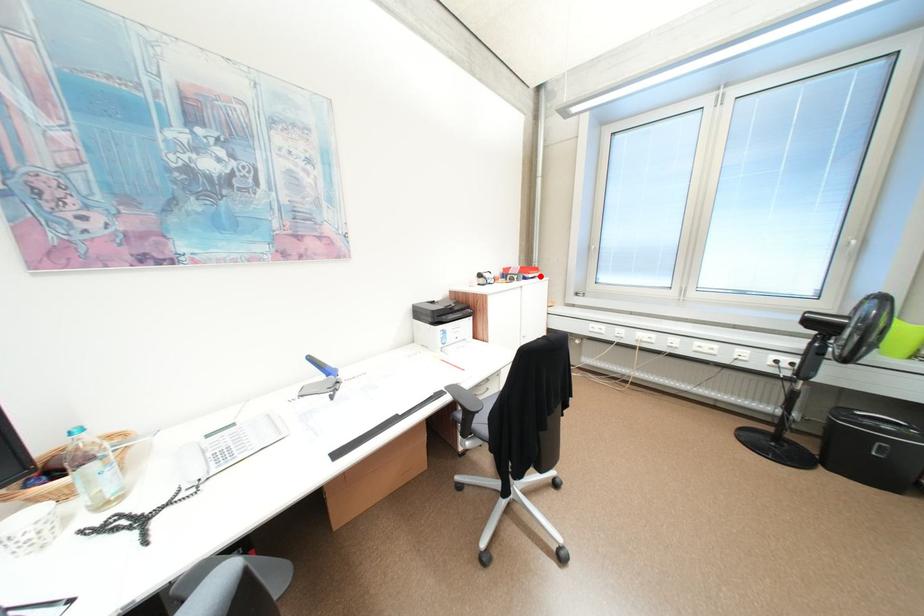
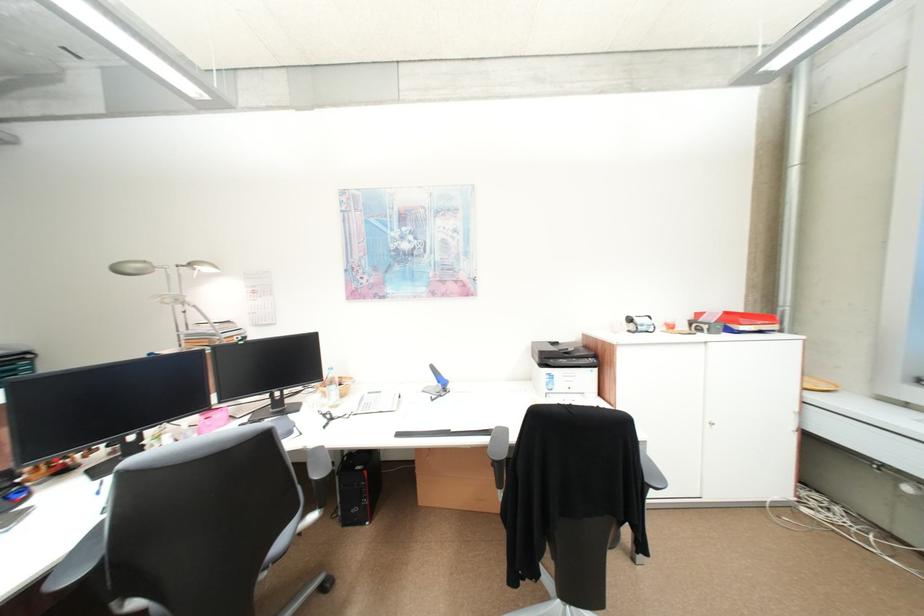
Locate, in the second image, the point that corresponds to the highlighted location in the first image.

(754, 329)